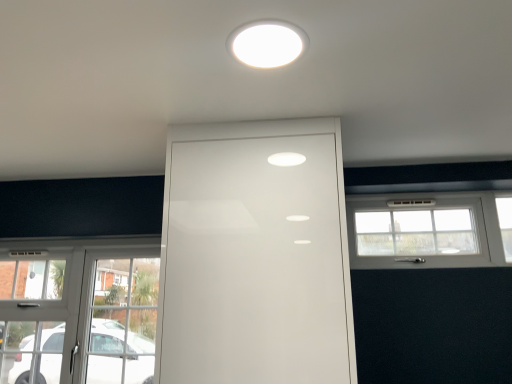
Question: Is white glossy door at center shorter than white glossy light fixture at upper center?

Choices:
 (A) yes
 (B) no

Answer: (B)

Question: Is white glossy door at center far from white glossy light fixture at upper center?

Choices:
 (A) no
 (B) yes

Answer: (A)

Question: Considering the relative sizes of white glossy door at center and white glossy light fixture at upper center in the image provided, is white glossy door at center taller than white glossy light fixture at upper center?

Choices:
 (A) no
 (B) yes

Answer: (B)

Question: Is white glossy door at center thinner than white glossy light fixture at upper center?

Choices:
 (A) yes
 (B) no

Answer: (B)

Question: Is white glossy door at center closer to the viewer compared to white glossy light fixture at upper center?

Choices:
 (A) yes
 (B) no

Answer: (B)

Question: From the image's perspective, is white glossy door at center beneath white glossy light fixture at upper center?

Choices:
 (A) yes
 (B) no

Answer: (A)

Question: Is white glossy light fixture at upper center touching white plastic window at right, the first window from the right?

Choices:
 (A) no
 (B) yes

Answer: (A)

Question: Considering the relative positions of white glossy light fixture at upper center and white plastic window at right, which is counted as the 2th window, starting from the left, in the image provided, is white glossy light fixture at upper center to the right of white plastic window at right, which is counted as the 2th window, starting from the left, from the viewer's perspective?

Choices:
 (A) no
 (B) yes

Answer: (A)

Question: Is white glossy light fixture at upper center positioned before white plastic window at right, marked as the 2th window in a bottom-to-top arrangement?

Choices:
 (A) yes
 (B) no

Answer: (A)

Question: Is white glossy light fixture at upper center to the left of white plastic window at right, arranged as the 1th window when viewed from the top, from the viewer's perspective?

Choices:
 (A) yes
 (B) no

Answer: (A)

Question: Is white glossy light fixture at upper center outside white plastic window at right, the first window from the right?

Choices:
 (A) yes
 (B) no

Answer: (A)

Question: From the image's perspective, does white glossy light fixture at upper center appear lower than white plastic window at right, which is counted as the 2th window, starting from the left?

Choices:
 (A) yes
 (B) no

Answer: (B)

Question: From a real-world perspective, is white glossy light fixture at upper center under clear glass door at lower left, which appears as the 2th window when viewed from the right?

Choices:
 (A) no
 (B) yes

Answer: (A)